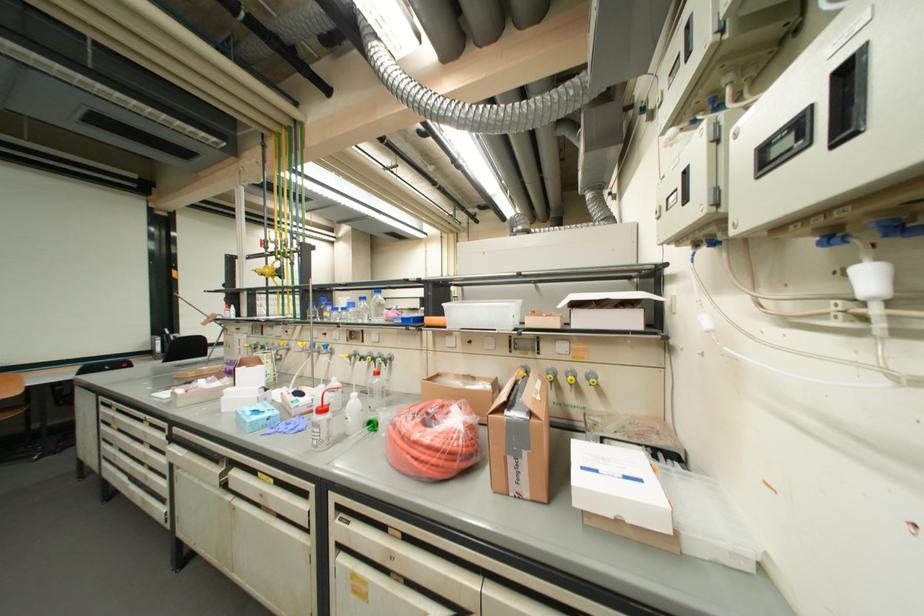
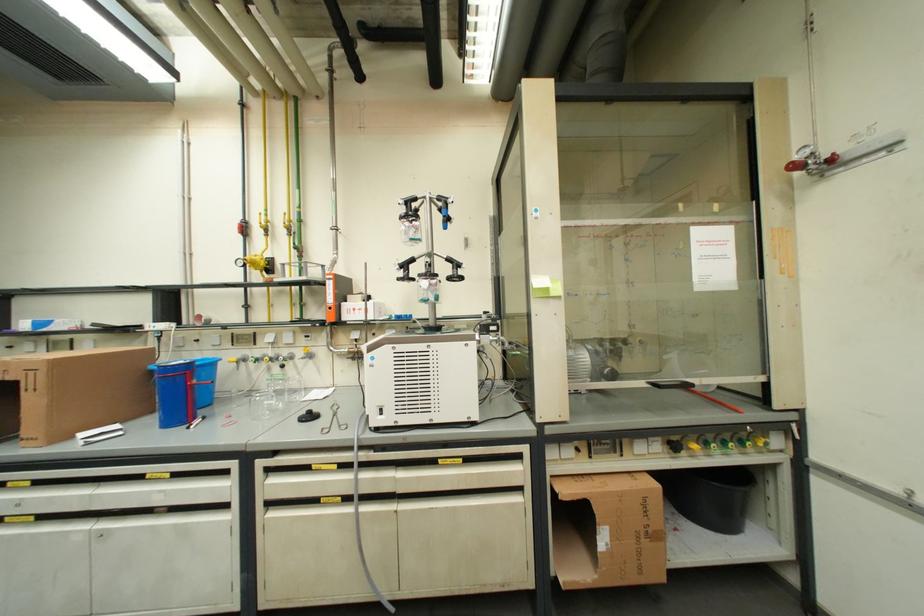
Question: Which direction would the cameraman need to move to produce the second image? Reply with the corresponding letter.

Choices:
 (A) Left
 (B) Right
 (C) Forward
 (D) Backward

Answer: (C)